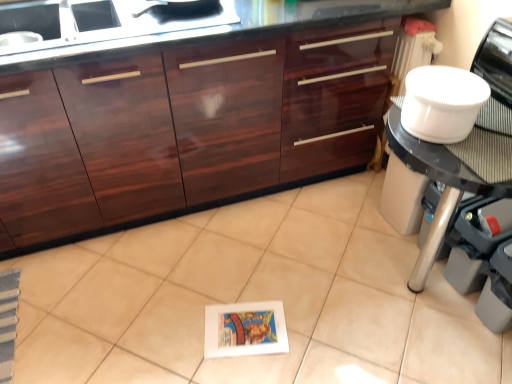
Question: From a real-world perspective, is white plastic bowl at upper right physically located above or below white plastic bowl at right?

Choices:
 (A) below
 (B) above

Answer: (B)

Question: Based on their positions, is white plastic bowl at upper right located to the left or right of white plastic bowl at right?

Choices:
 (A) right
 (B) left

Answer: (A)

Question: Estimate the real-world distances between objects in this image. Which object is closer to the white glossy tile at center?

Choices:
 (A) white plastic bowl at right
 (B) white paper book at center
 (C) glossy wood cabinetry at center
 (D) white plastic bowl at upper right

Answer: (B)

Question: Which of these objects is positioned closest to the glossy wood cabinetry at center?

Choices:
 (A) white glossy tile at center
 (B) white paper book at center
 (C) white plastic bowl at upper right
 (D) white plastic bowl at right

Answer: (A)